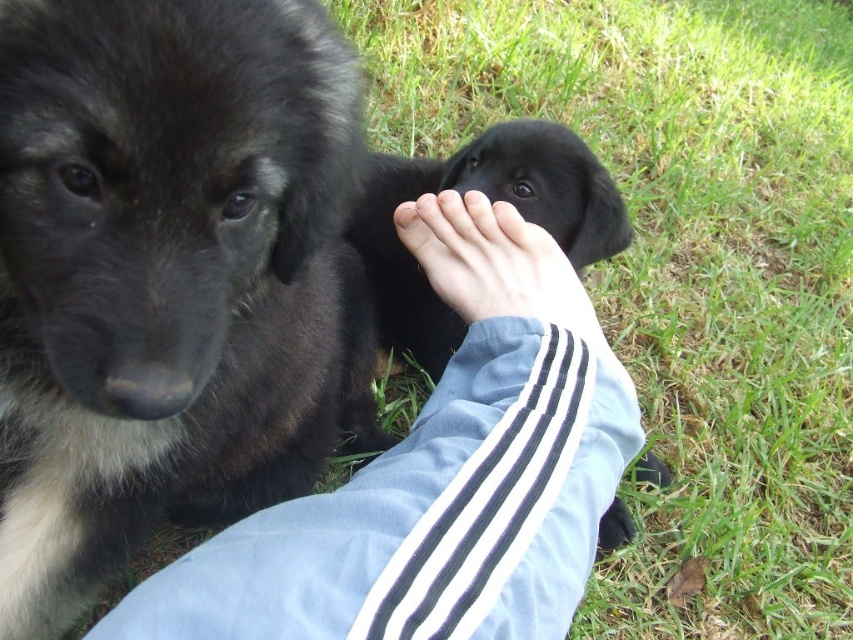
From the picture: Is skinny white hand at center to the right of black fur paw at lower center from the viewer's perspective?

In fact, skinny white hand at center is to the left of black fur paw at lower center.

Does point (416, 218) lie in front of point (618, 524)?

Yes, point (416, 218) is in front of point (618, 524).

This screenshot has width=853, height=640. Find the location of `skinny white hand at center`. skinny white hand at center is located at coordinates (492, 262).

Who is shorter, green grass at lower right or black fur dog at center?

Standing shorter between the two is black fur dog at center.

Can you confirm if green grass at lower right is smaller than black fur dog at center?

Actually, green grass at lower right might be larger than black fur dog at center.

Is point (650, 291) farther from viewer compared to point (383, 330)?

That is True.

At what (x,y) coordinates should I click in order to perform the action: click on green grass at lower right. Please return your answer as a coordinate pair (x, y). Looking at the image, I should click on (685, 269).

From the picture: Can you confirm if green grass at lower right is shorter than light blue fabric at center?

Incorrect, green grass at lower right's height does not fall short of light blue fabric at center's.

Between point (712, 244) and point (532, 276), which one is positioned behind?

Point (712, 244)

The height and width of the screenshot is (640, 853). Find the location of `green grass at lower right`. green grass at lower right is located at coordinates pyautogui.click(x=685, y=269).